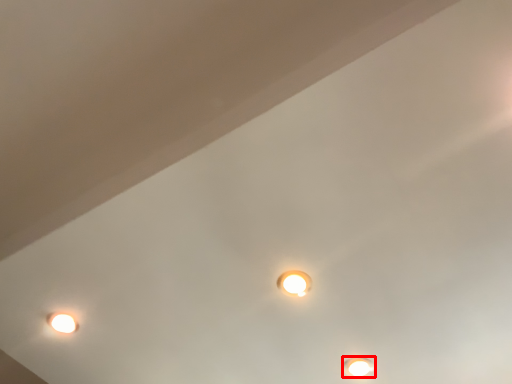
Question: Considering the relative positions of lamp (annotated by the red box) and lamp in the image provided, where is lamp (annotated by the red box) located with respect to the staircase?

Choices:
 (A) right
 (B) left

Answer: (A)